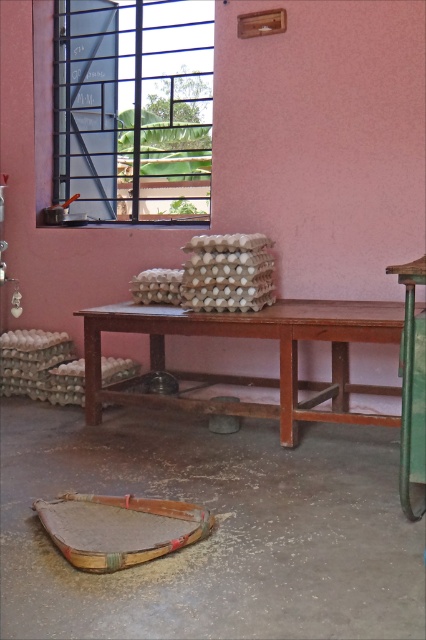
You are an interior designer planning to place a new piece of furniture in the workshop. You have a small bench that is 1 meter wide. The bench needs to be placed between the metallic grid window at upper left and the green plastic stool at lower right. Is there enough space between them to fit the bench?

The metallic grid window at upper left is positioned on the left side of green plastic stool at lower right. Since the bench is 1 meter wide, we need to know the distance between them to determine if it fits. However, the provided information does not specify the distance between the two objects. Therefore, we cannot confirm if the bench will fit without additional measurements.

You are a delivery person who needs to place a 10 feet long ladder between the metallic grid window at upper left and the green plastic stool at lower right. Is there enough space to place the ladder horizontally without it touching either object?

The metallic grid window at upper left and green plastic stool at lower right are 11.25 feet apart from each other. Since the ladder is 10 feet long, there is sufficient space to place it horizontally between them without touching either object.